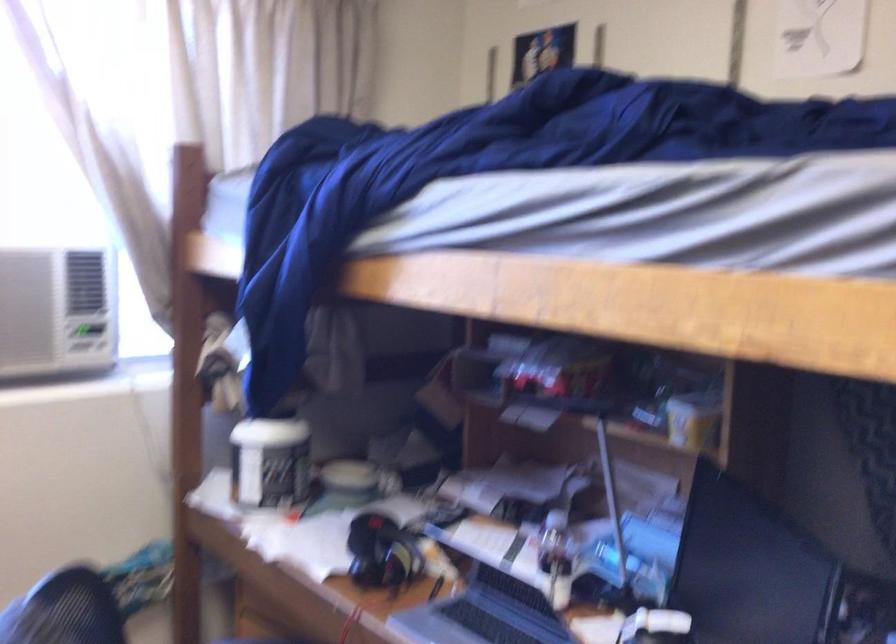
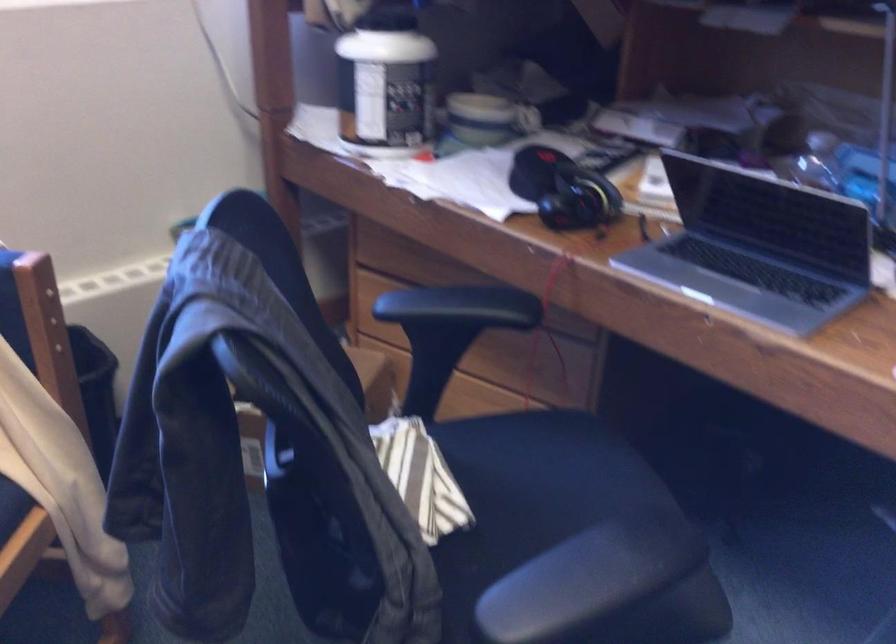
What movement of the cameraman would produce the second image?

The movement direction of the cameraman is left, forward.